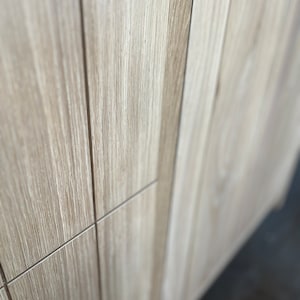
Where is `the 2nd bottom board`? the 2nd bottom board is located at coordinates (36, 284).